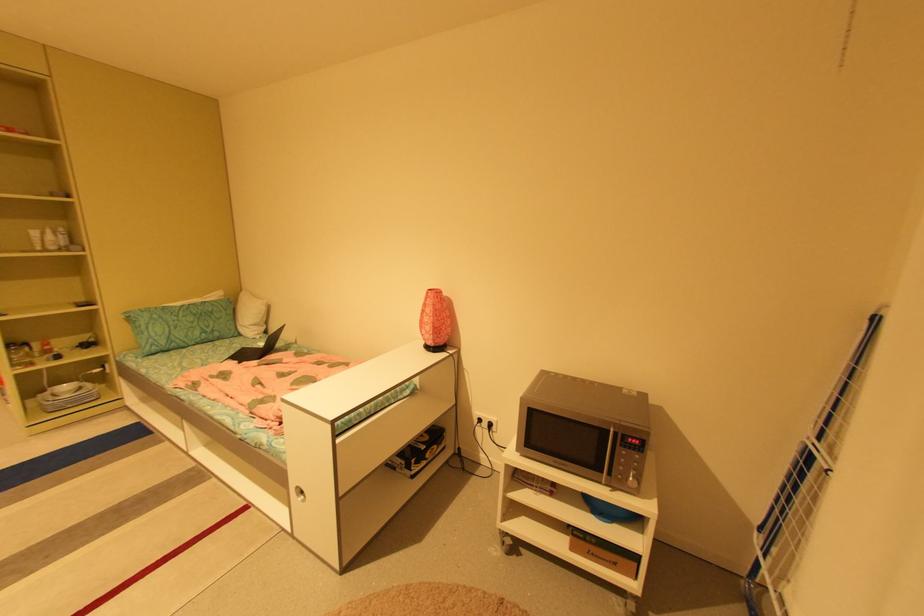
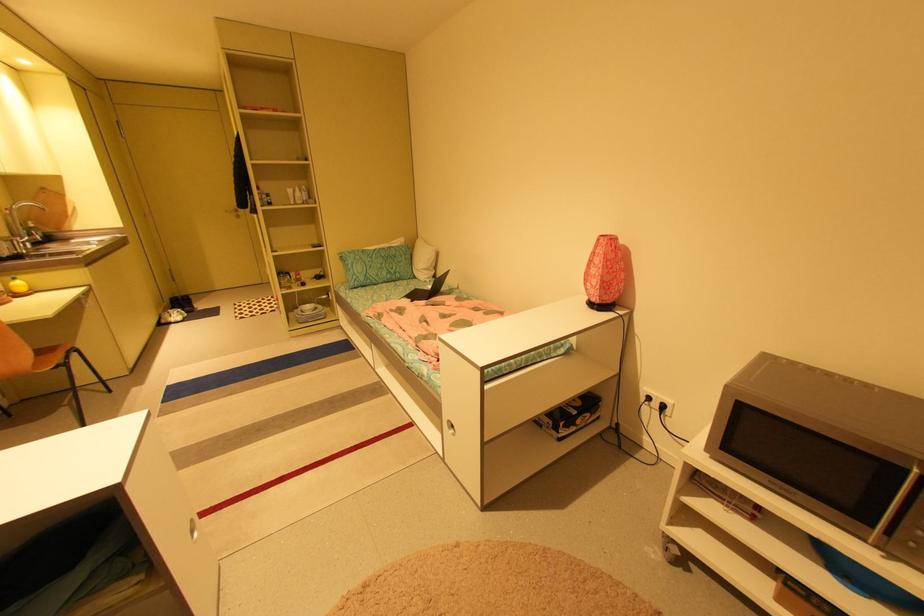
Find the pixel in the second image that matches pixel 436 290 in the first image.

(608, 236)